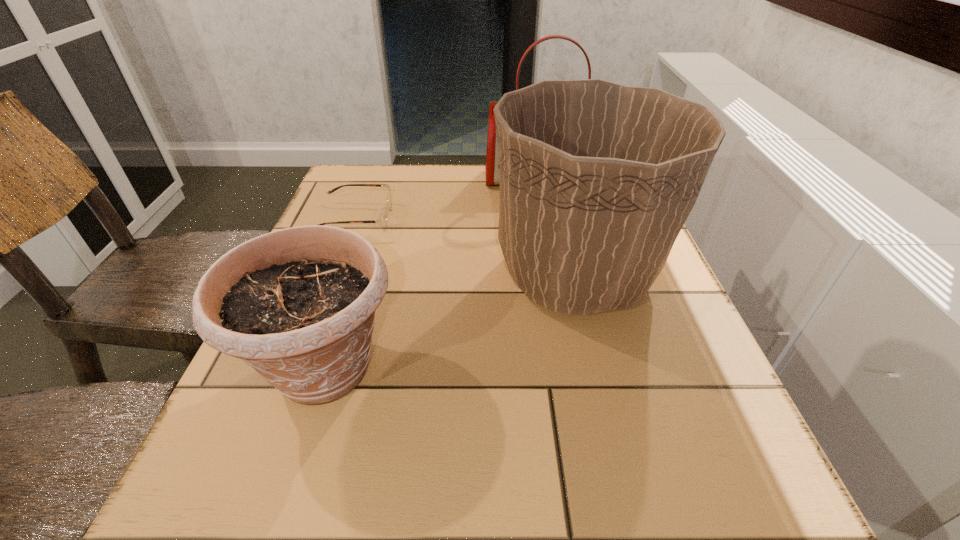
Where is `free spot at the right edge of the desktop`? free spot at the right edge of the desktop is located at coordinates (636, 435).

You are a GUI agent. You are given a task and a screenshot of the screen. Output one action in this format:
    pyautogui.click(x=<x>, y=<y>)
    Task: Click on the free space at the near left corner
    
    Given the screenshot: What is the action you would take?
    pyautogui.click(x=206, y=496)

Locate an element on the screen. Image resolution: width=960 pixels, height=540 pixels. free space at the near right corner is located at coordinates (673, 526).

Locate an element on the screen. The height and width of the screenshot is (540, 960). unoccupied position between the farthest object and the shorter flowerpot is located at coordinates (434, 273).

This screenshot has height=540, width=960. I want to click on unoccupied area between the taller flowerpot and the spectacles, so click(x=466, y=247).

Locate an element on the screen. The image size is (960, 540). vacant area between the right flowerpot and the spectacles is located at coordinates (466, 247).

Find the location of `vacant space that is in between the left flowerpot and the handbag`. vacant space that is in between the left flowerpot and the handbag is located at coordinates 434,273.

Identify the location of blank region between the handbag and the third tallest object. The width and height of the screenshot is (960, 540). (434, 273).

The height and width of the screenshot is (540, 960). Find the location of `empty location between the second shortest object and the right flowerpot`. empty location between the second shortest object and the right flowerpot is located at coordinates (450, 321).

The height and width of the screenshot is (540, 960). What are the coordinates of `vacant space that is in between the right flowerpot and the spectacles` in the screenshot? It's located at (466, 247).